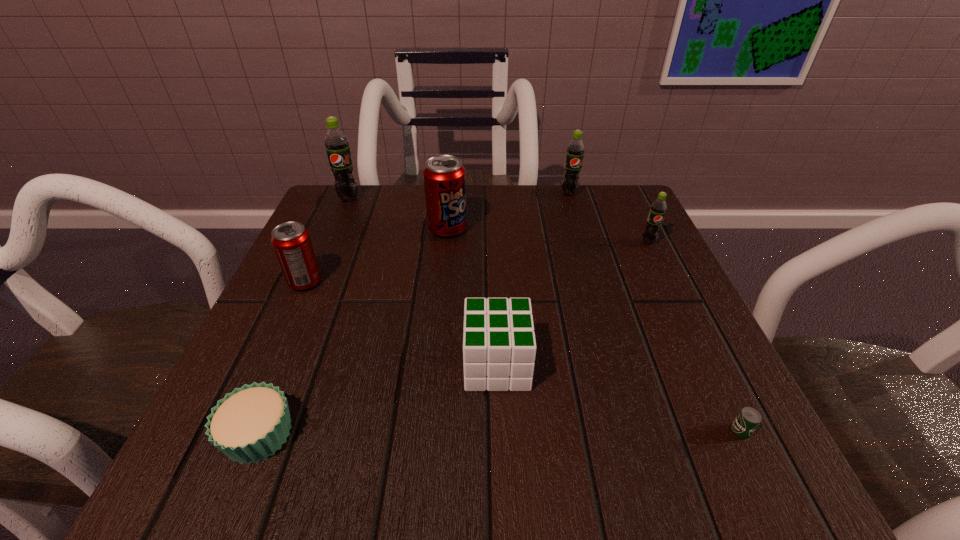
Identify the location of the leftmost green soda. The image size is (960, 540). (336, 143).

Where is `the biggest green soda`? This screenshot has height=540, width=960. the biggest green soda is located at coordinates (336, 143).

Where is `the fourth object from left to right`? the fourth object from left to right is located at coordinates click(x=444, y=175).

Image resolution: width=960 pixels, height=540 pixels. In order to click on the farther red soda can in this screenshot , I will do `click(444, 175)`.

In order to click on the third object from right to left in this screenshot , I will do `click(575, 150)`.

Find the location of a particular element. This screenshot has width=960, height=540. the second biggest green soda is located at coordinates (575, 150).

Identify the location of the rightmost green soda. pos(658,208).

You are a GUI agent. You are given a task and a screenshot of the screen. Output one action in this format:
    pyautogui.click(x=<x>, y=<y>)
    Task: Click on the smallest green soda
    
    Given the screenshot: What is the action you would take?
    pyautogui.click(x=658, y=208)

What are the coordinates of `the left red soda can` in the screenshot? It's located at (291, 241).

Where is `the nearest soda can`? the nearest soda can is located at coordinates (291, 241).